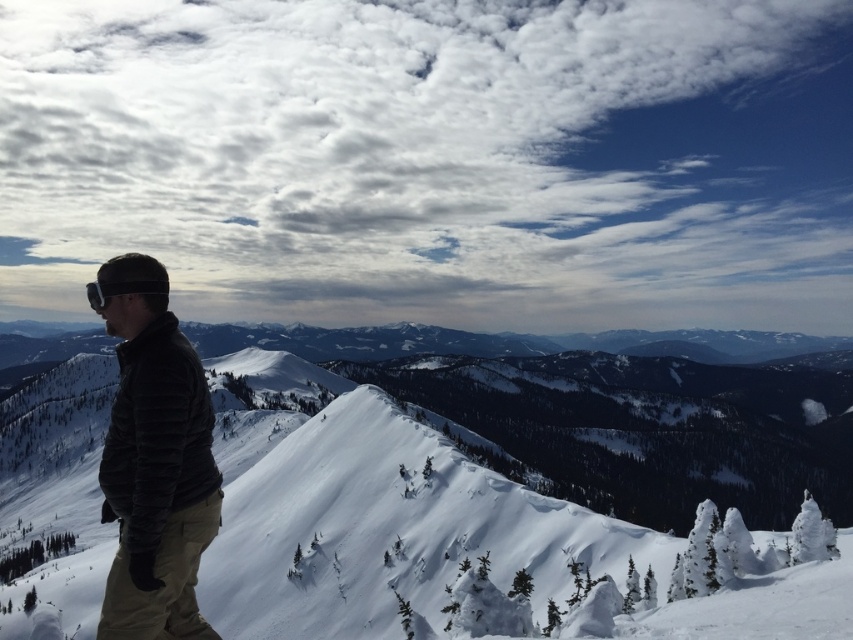
You are a photographer trying to capture the perfect shot of the white fluffy snow at center. Based on its coordinates, where should you position your camera to ensure it is centered in the frame?

Since the white fluffy snow at center is located at coordinates point (491, 474), you should position your camera so that the center of the frame aligns with this point to capture it perfectly.

In the scene shown: You are an outdoor photographer preparing to take a photo of the dark gray quilted jacket at left and the matte black goggles at left. You want to ensure both items are in focus. Since you know that smaller objects require a closer focus distance, which item should you adjust your camera focus on first?

The dark gray quilted jacket at left has a smaller width than the matte black goggles at left, so you should focus on the dark gray quilted jacket at left first because it is smaller and requires closer focus.

You are standing at the point with coordinates point (x=158, y=536) and want to walk to the point with coordinates point (x=680, y=397). Based on the scene description, will the path between these two points be obstructed by any objects?

The point (x=680, y=397) is behind point (x=158, y=536), so the path between them would not be obstructed by any objects since there are no objects mentioned in the scene that could block the view or path between these two points.